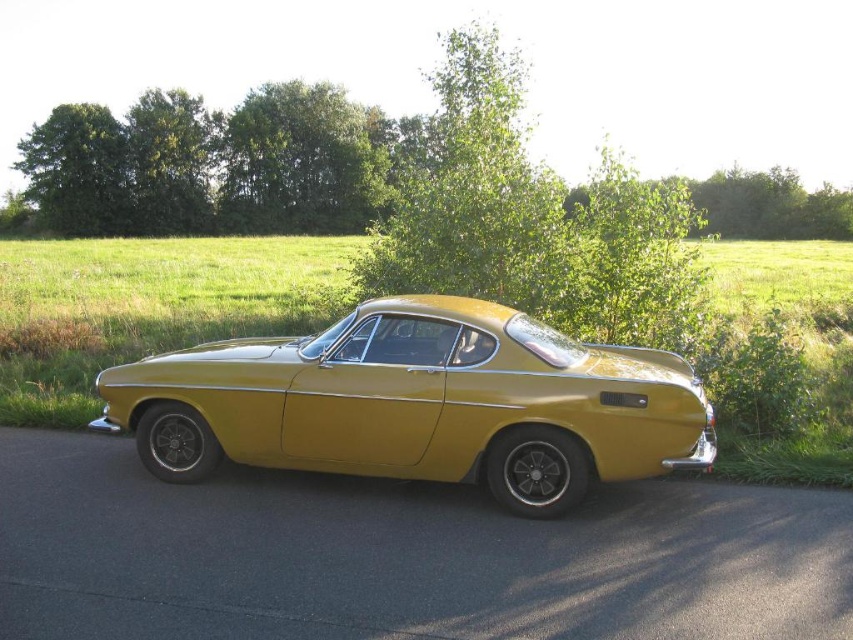
Question: Considering the relative positions of metallic gold car at center and green leafy tree at center in the image provided, where is metallic gold car at center located with respect to green leafy tree at center?

Choices:
 (A) above
 (B) below

Answer: (B)

Question: Can you confirm if metallic gold car at center is bigger than green leafy tree at center?

Choices:
 (A) no
 (B) yes

Answer: (A)

Question: Among these objects, which one is nearest to the camera?

Choices:
 (A) green leafy trees at upper left
 (B) green leafy tree at center
 (C) metallic gold car at center

Answer: (C)

Question: Among these points, which one is farthest from the camera?

Choices:
 (A) (258, 100)
 (B) (813, 202)
 (C) (624, 360)

Answer: (B)

Question: Which object is positioned closest to the green leafy trees at upper left?

Choices:
 (A) metallic gold car at center
 (B) green leafy tree at center

Answer: (B)

Question: Is green leafy trees at upper left to the left of green leafy tree at center from the viewer's perspective?

Choices:
 (A) no
 (B) yes

Answer: (B)